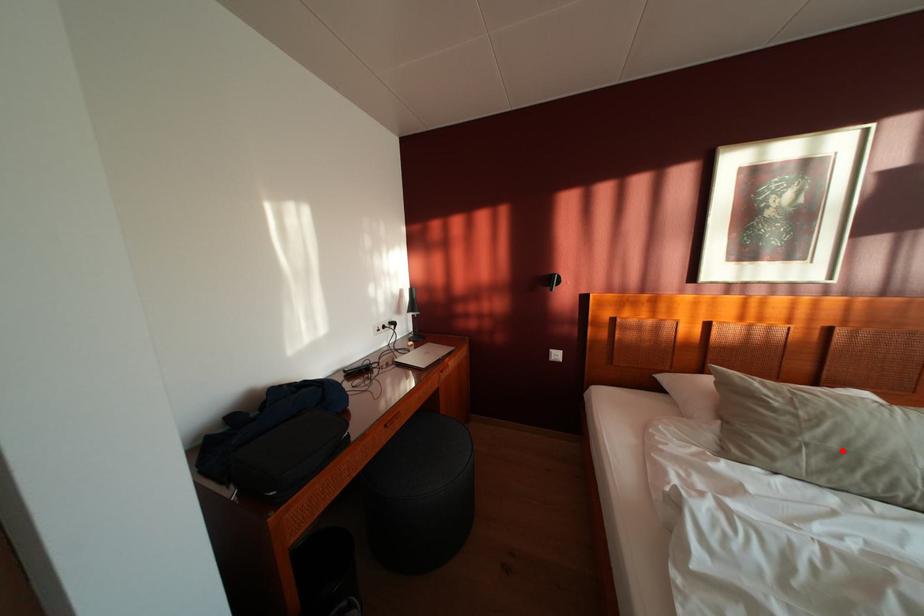
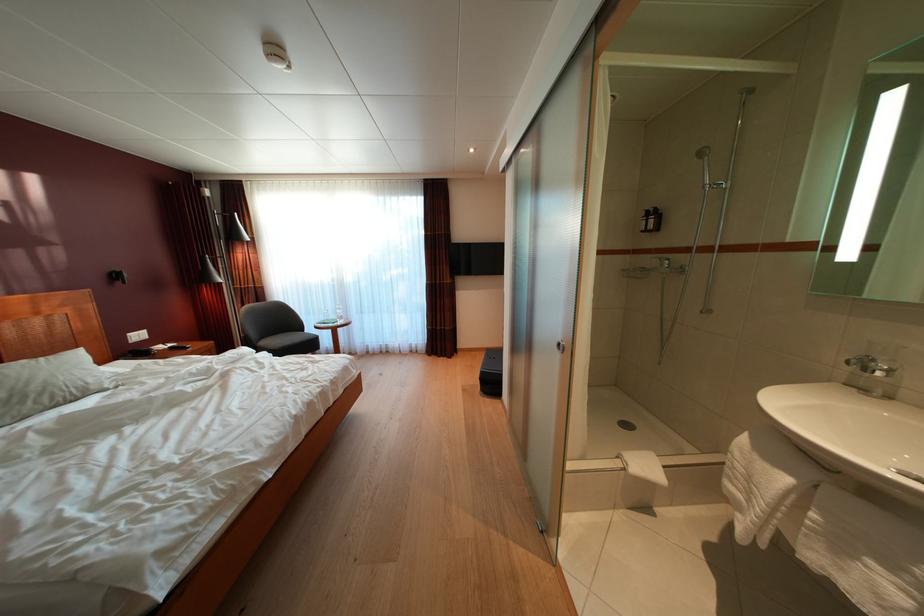
Find the pixel in the second image that matches the highlighted location in the first image.

(10, 400)